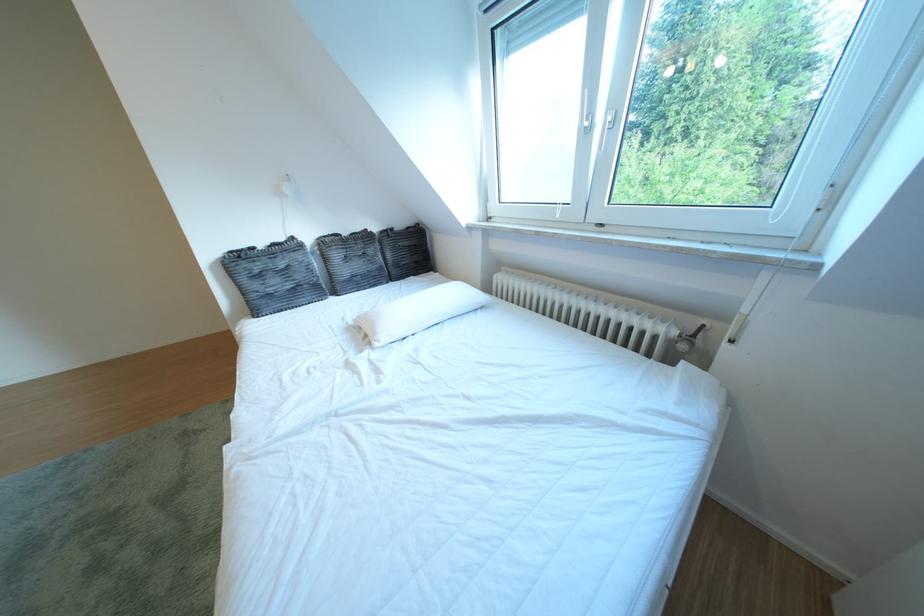
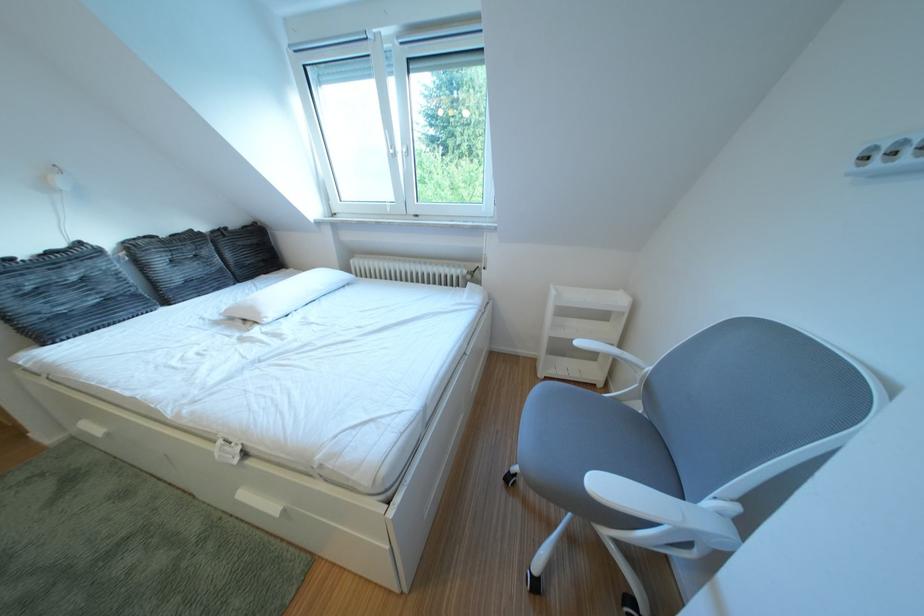
Question: How did the camera likely rotate?

Choices:
 (A) Left
 (B) Right
 (C) Up
 (D) Down

Answer: (B)